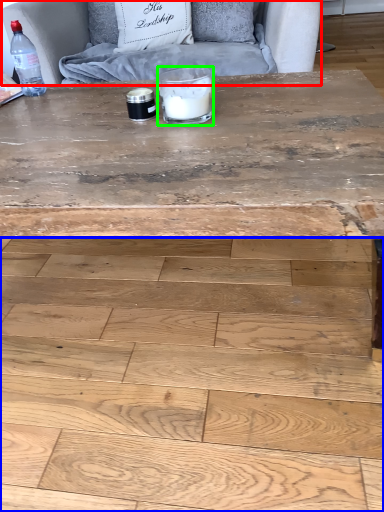
Question: Which object is the closest to the armchair (highlighted by a red box)? Choose among these: plywood (highlighted by a blue box) or candle holder (highlighted by a green box).

Choices:
 (A) plywood
 (B) candle holder

Answer: (B)